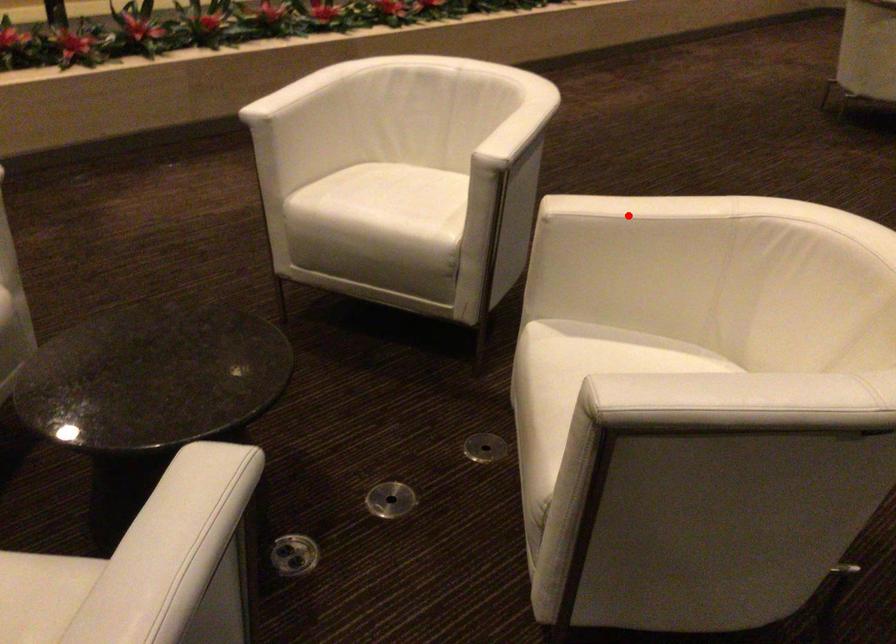
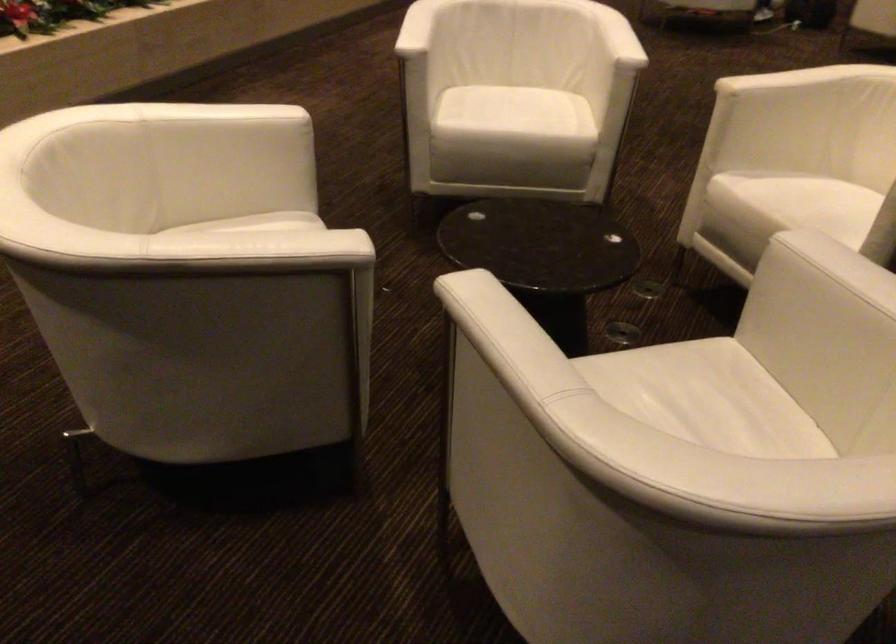
Find the pixel in the second image that matches the highlighted location in the first image.

(789, 80)